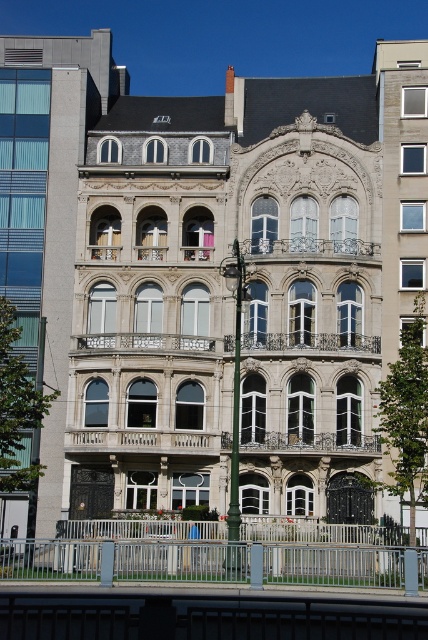
Question: In this image, where is silver metallic railing at lower center located relative to green metallic pole at center?

Choices:
 (A) right
 (B) left

Answer: (B)

Question: Can you confirm if silver metallic railing at lower center is positioned to the right of green metallic pole at center?

Choices:
 (A) no
 (B) yes

Answer: (A)

Question: Which point is closer to the camera?

Choices:
 (A) (45, 570)
 (B) (237, 269)

Answer: (A)

Question: Can you confirm if silver metallic railing at lower center is bigger than green metallic pole at center?

Choices:
 (A) yes
 (B) no

Answer: (B)